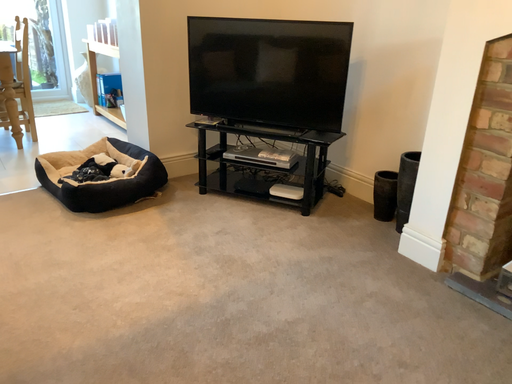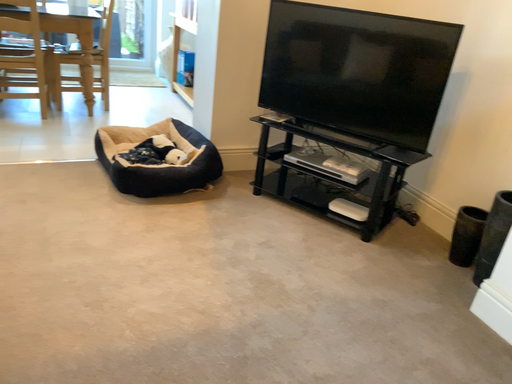
Question: How did the camera likely rotate when shooting the video?

Choices:
 (A) rotated left
 (B) rotated right

Answer: (A)